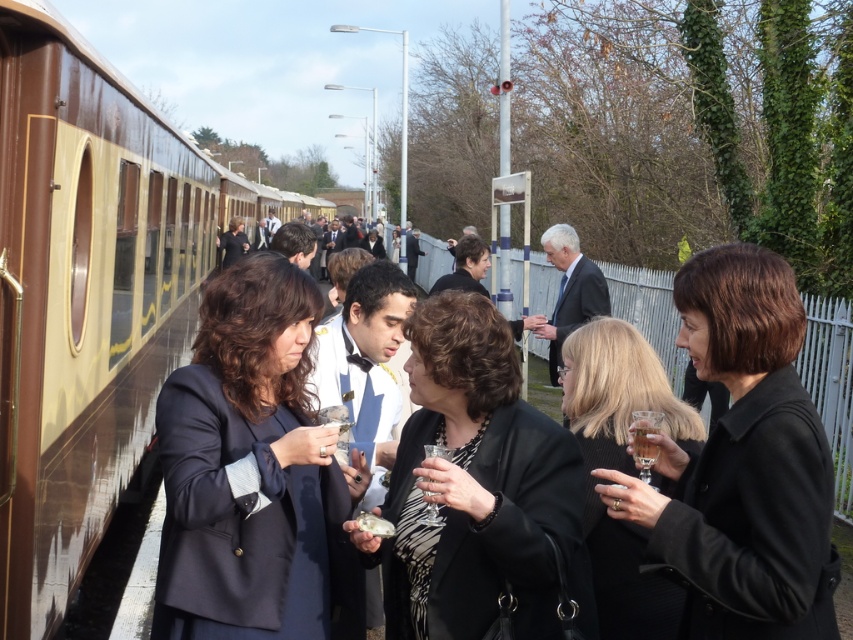
You are a photographer at the event. You want to take a photo of the blonde hair at center and the clear glass at center. Which object should you focus on first if you want to capture both in a single shot without moving the camera?

The blonde hair at center has a larger size compared to the clear glass at center, so you should focus on the larger object first to ensure both are in focus within the depth of field.

You are standing at the train station platform and want to take a photo of both the point at coordinates point[212,310] and point[526,465]. Which point should you focus on first to ensure both are in focus?

You should focus on point[212,310] first because it is closer to the camera than point[526,465], ensuring both points will be in focus when using depth of field.

Looking at this image, you are a photographer trying to capture both the brown polished wood passenger train at left and the black matte coat at right in a single frame. Since the train is larger, will it appear more prominent in the photo?

The brown polished wood passenger train at left is larger than the black matte coat at right, so it will appear more prominent in the photo.